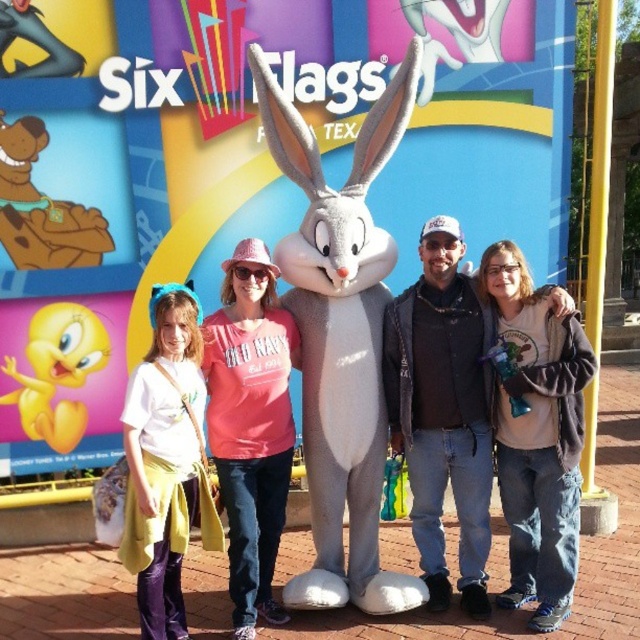
Based on the photo, you are standing at point (236, 419) and want to move to the Six Flags entrance, which is located at point (577, 502). However, there is a mascot parade route that runs between these two points. Since the mascot parade is currently ongoing, you need to know if your path is blocked. Based on the spatial relationship between these two points, can you determine if the path is blocked by the parade route?

Point (577, 502) is behind point (236, 419), so the path between them is likely blocked by the mascot parade route.

You are standing in front of the white plush rabbit at center at Six Flags. You want to take a photo with it without getting too close. If your camera can focus on objects up to 5 meters away, will you be able to take a clear photo from your current position?

The white plush rabbit at center is 4.17 meters away from viewer. Since your camera can focus up to 5 meters, you can take a clear photo from your current position.

You are taking a photo at Six Flags and want to focus on both the Bugs Bunny mascot and the group of people. The mascot is at point (353, 275) and the group is at point (534, 406). Which point should you focus on first to ensure both are in focus?

You should focus on point (353, 275) first because it is closer to the camera than point (534, 406). This way, adjusting the focus from the closer point outward will help both subjects be in focus.